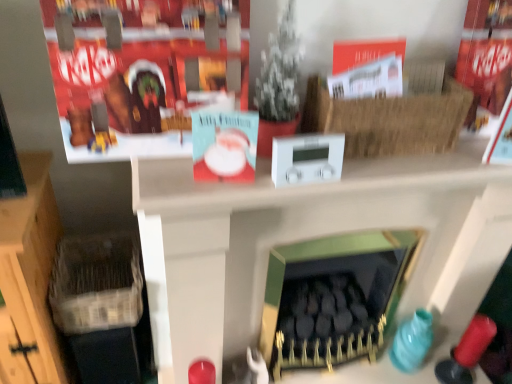
Question: Is green matte fireplace at center bigger than red cardboard box at upper left?

Choices:
 (A) yes
 (B) no

Answer: (A)

Question: From a real-world perspective, does green matte fireplace at center stand above red cardboard box at upper left?

Choices:
 (A) no
 (B) yes

Answer: (A)

Question: Are green matte fireplace at center and red cardboard box at upper left located far from each other?

Choices:
 (A) no
 (B) yes

Answer: (A)

Question: From the image's perspective, is green matte fireplace at center located above red cardboard box at upper left?

Choices:
 (A) yes
 (B) no

Answer: (B)

Question: Considering the relative sizes of green matte fireplace at center and red cardboard box at upper left in the image provided, is green matte fireplace at center thinner than red cardboard box at upper left?

Choices:
 (A) yes
 (B) no

Answer: (A)

Question: Is green matte fireplace at center situated inside green matte fireplace at center or outside?

Choices:
 (A) inside
 (B) outside

Answer: (A)

Question: Based on their sizes in the image, would you say green matte fireplace at center is bigger or smaller than green matte fireplace at center?

Choices:
 (A) small
 (B) big

Answer: (A)

Question: In terms of width, does green matte fireplace at center look wider or thinner when compared to green matte fireplace at center?

Choices:
 (A) thin
 (B) wide

Answer: (A)

Question: Visually, is green matte fireplace at center positioned to the left or to the right of green matte fireplace at center?

Choices:
 (A) right
 (B) left

Answer: (A)

Question: Considering the positions of green matte fireplace at center and red cardboard box at upper left in the image, is green matte fireplace at center wider or thinner than red cardboard box at upper left?

Choices:
 (A) wide
 (B) thin

Answer: (B)

Question: Which is correct: green matte fireplace at center is inside red cardboard box at upper left, or outside of it?

Choices:
 (A) inside
 (B) outside

Answer: (B)

Question: Does point (185, 251) appear closer or farther from the camera than point (245, 102)?

Choices:
 (A) closer
 (B) farther

Answer: (B)

Question: Relative to red cardboard box at upper left, is green matte fireplace at center in front or behind?

Choices:
 (A) behind
 (B) front

Answer: (A)

Question: Is green matte fireplace at center wider or thinner than braided straw basket at upper right, the 1th basket from the front?

Choices:
 (A) wide
 (B) thin

Answer: (A)

Question: Looking at the image, does green matte fireplace at center seem bigger or smaller compared to braided straw basket at upper right, the 2th basket positioned from the bottom?

Choices:
 (A) big
 (B) small

Answer: (A)